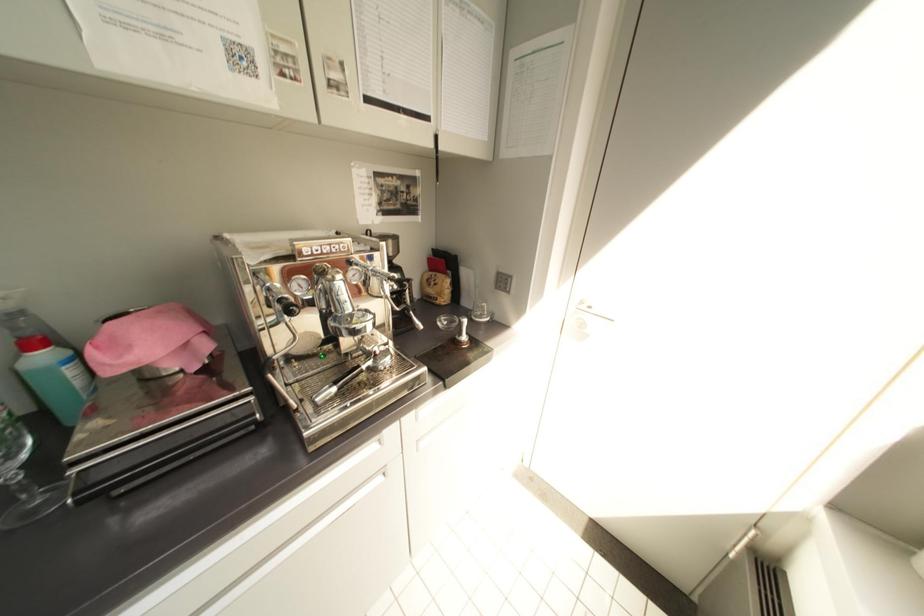
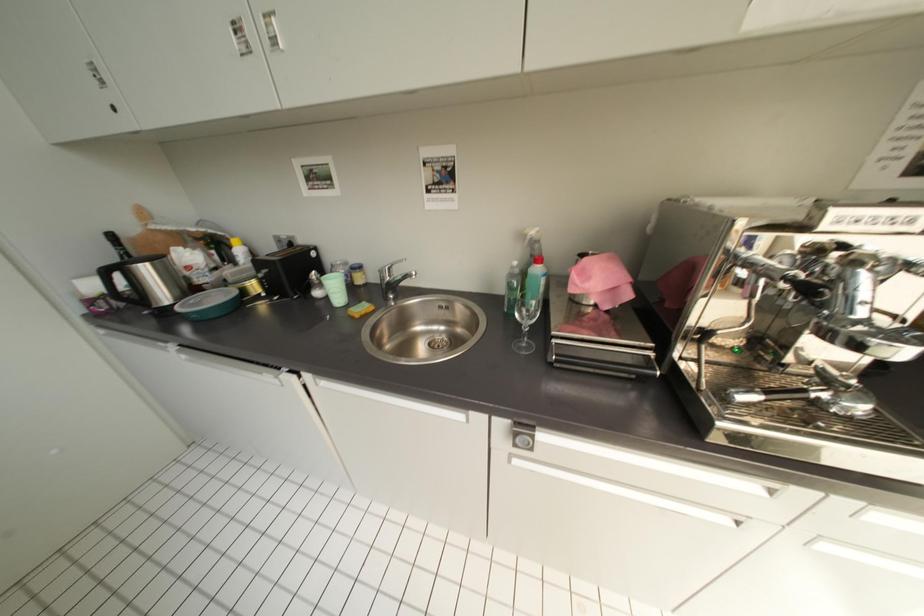
How did the camera likely rotate?

The rotation direction of the camera is left-down.